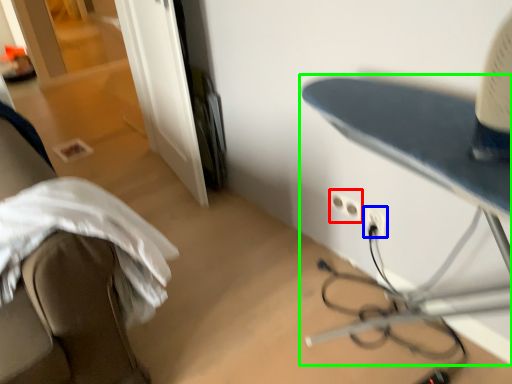
Question: Considering the real-world distances, which object is farthest from electric outlet (highlighted by a red box)? electric outlet (highlighted by a blue box) or table (highlighted by a green box)?

Choices:
 (A) electric outlet
 (B) table

Answer: (B)